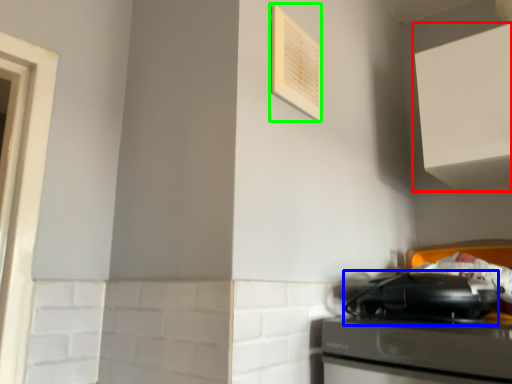
Question: Estimate the real-world distances between objects in this image. Which object is closer to cabinetry (highlighted by a red box), appliance (highlighted by a blue box) or air conditioner (highlighted by a green box)?

Choices:
 (A) appliance
 (B) air conditioner

Answer: (A)